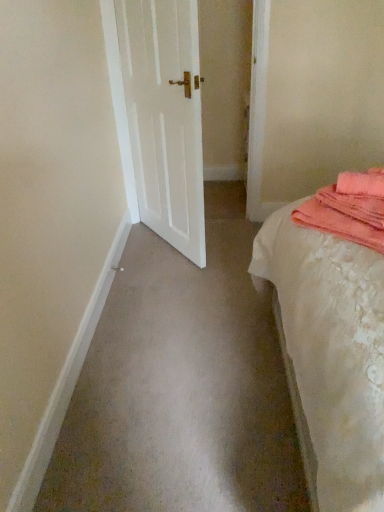
Question: From the image's perspective, is pink towel at right over white lace bed at right?

Choices:
 (A) no
 (B) yes

Answer: (B)

Question: From the image's perspective, is pink towel at right beneath white lace bed at right?

Choices:
 (A) no
 (B) yes

Answer: (A)

Question: Is pink towel at right at the right side of white lace bed at right?

Choices:
 (A) no
 (B) yes

Answer: (B)

Question: Would you say pink towel at right is a long distance from white lace bed at right?

Choices:
 (A) no
 (B) yes

Answer: (A)

Question: Can white lace bed at right be found inside pink towel at right?

Choices:
 (A) no
 (B) yes

Answer: (A)

Question: Is pink towel at right bigger or smaller than white matte door at center?

Choices:
 (A) small
 (B) big

Answer: (A)

Question: From the image's perspective, is pink towel at right located above or below white matte door at center?

Choices:
 (A) below
 (B) above

Answer: (A)

Question: Considering their positions, is pink towel at right located in front of or behind white matte door at center?

Choices:
 (A) front
 (B) behind

Answer: (A)

Question: Is point (367, 194) positioned closer to the camera than point (122, 75)?

Choices:
 (A) farther
 (B) closer

Answer: (B)

Question: From the image's perspective, relative to white lace bed at right, is white matte door at center above or below?

Choices:
 (A) below
 (B) above

Answer: (B)

Question: In the image, is white matte door at center positioned in front of or behind white lace bed at right?

Choices:
 (A) front
 (B) behind

Answer: (B)

Question: In terms of size, does white matte door at center appear bigger or smaller than white lace bed at right?

Choices:
 (A) big
 (B) small

Answer: (B)

Question: Considering the positions of point (173, 236) and point (357, 437), is point (173, 236) closer or farther from the camera than point (357, 437)?

Choices:
 (A) closer
 (B) farther

Answer: (B)

Question: From the image's perspective, is white lace bed at right positioned above or below pink towel at right?

Choices:
 (A) above
 (B) below

Answer: (B)

Question: Visually, is white lace bed at right positioned to the left or to the right of pink towel at right?

Choices:
 (A) left
 (B) right

Answer: (A)